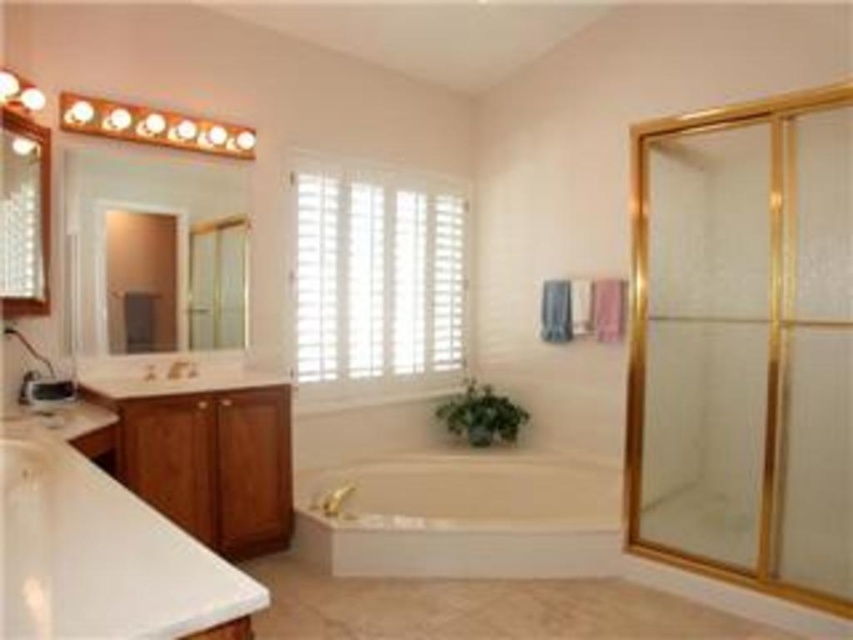
You are standing in the bathroom and want to determine which of the two points, point (73, 602) or point (22, 180), is closer to you. Based on the scene description, which point is nearer?

Point (73, 602) is closer to the viewer than point (22, 180).

You are a home inspector assessing the bathroom layout. You need to determine if the clear glass shower door at right can be seen in the reflection of the brushed metal faucet at left. Based on their positions and heights, what is your conclusion?

The clear glass shower door at right has a greater height compared to the brushed metal faucet at left. Since the shower door is taller, its reflection might extend higher in the mirror, but the faucet being shorter may not reflect the entire shower door. However, without knowing the exact angle and placement of the mirror, it is uncertain if the entire shower door is visible in the faucet reflection.

You are standing in the bathroom and want to reach both the point at coordinates point (x=778, y=461) and point (x=193, y=365). Which point will you reach first?

You will reach point (x=778, y=461) first because it is closer to you than point (x=193, y=365).